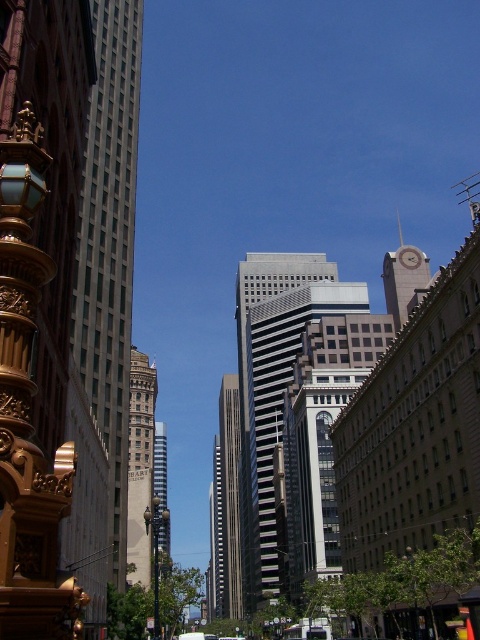
Measure the distance between gray glass skyscraper at left and camera.

gray glass skyscraper at left and camera are 61.31 meters apart from each other.

Is gray glass skyscraper at left wider than smooth glass skyscraper at center?

No.

Does point (96, 164) lie in front of point (227, 556)?

Yes, point (96, 164) is in front of point (227, 556).

This screenshot has height=640, width=480. What are the coordinates of `gray glass skyscraper at left` in the screenshot? It's located at (105, 304).

Between gray glass skyscraper at left and gold ornate lamp post at left, which one has less height?

gold ornate lamp post at left

Is gray glass skyscraper at left behind gold ornate lamp post at left?

Yes, it is.

The height and width of the screenshot is (640, 480). In order to click on gray glass skyscraper at left in this screenshot , I will do `click(105, 304)`.

The width and height of the screenshot is (480, 640). In order to click on gray glass skyscraper at left in this screenshot , I will do `click(105, 304)`.

Which is more to the left, brown stone tower at center or gold textured clock tower at upper right?

Positioned to the left is brown stone tower at center.

Between point (129, 577) and point (395, 272), which one is positioned behind?

The point (395, 272) is behind.

What do you see at coordinates (140, 465) in the screenshot?
I see `brown stone tower at center` at bounding box center [140, 465].

You are a GUI agent. You are given a task and a screenshot of the screen. Output one action in this format:
    pyautogui.click(x=<x>, y=<y>)
    Task: Click on the brown stone tower at center
    The image size is (480, 640).
    Given the screenshot: What is the action you would take?
    pyautogui.click(x=140, y=465)